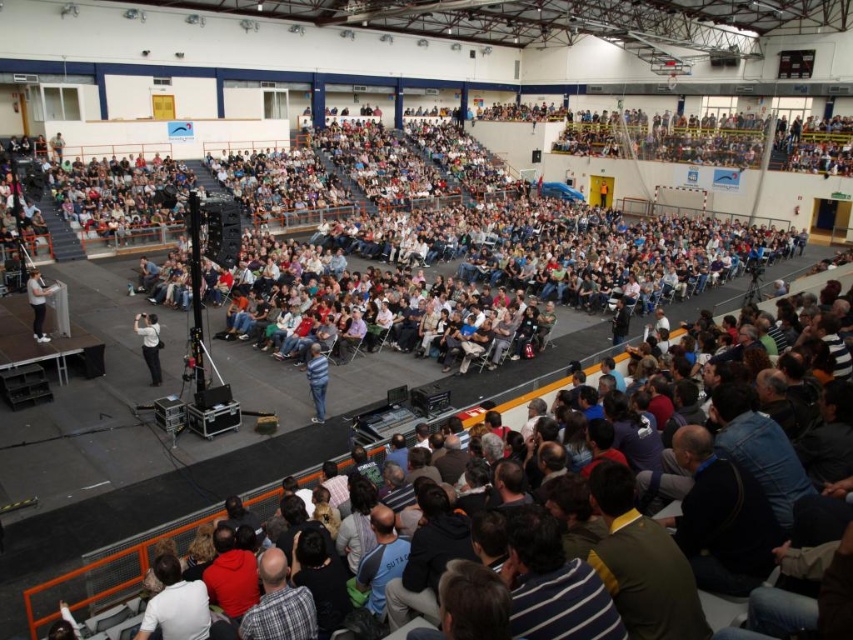
Is white matte shirt at center shorter than striped shirt at center?

No.

Which is below, white matte shirt at center or striped shirt at center?

striped shirt at center is lower down.

Who is more forward, (146, 332) or (314, 372)?

Positioned in front is point (314, 372).

Locate an element on the screen. white matte shirt at center is located at coordinates (149, 342).

Can you confirm if striped shirt at center is taller than white fabric shirt at left?

Yes.

Between point (316, 349) and point (50, 292), which one is positioned behind?

The point (50, 292) is behind.

Where is `striped shirt at center`? The height and width of the screenshot is (640, 853). striped shirt at center is located at coordinates (317, 380).

At what (x,y) coordinates should I click in order to perform the action: click on white matte shirt at center. Please return your answer as a coordinate pair (x, y). The image size is (853, 640). Looking at the image, I should click on tap(149, 342).

Which is above, white matte shirt at center or white fabric shirt at left?

white fabric shirt at left is above.

Between point (148, 314) and point (35, 320), which one is positioned in front?

Point (35, 320)

Locate an element on the screen. white matte shirt at center is located at coordinates (149, 342).